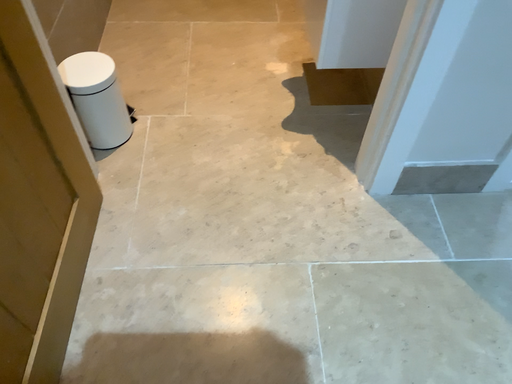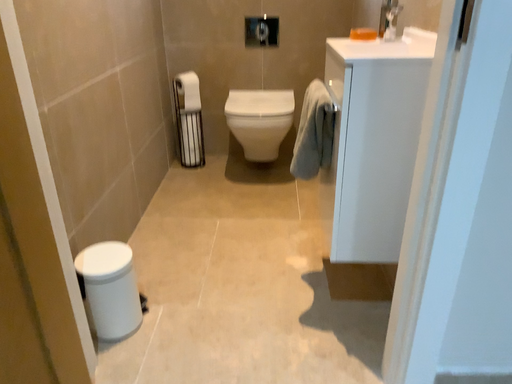
Question: Which way did the camera rotate in the video?

Choices:
 (A) rotated downward
 (B) rotated upward

Answer: (B)